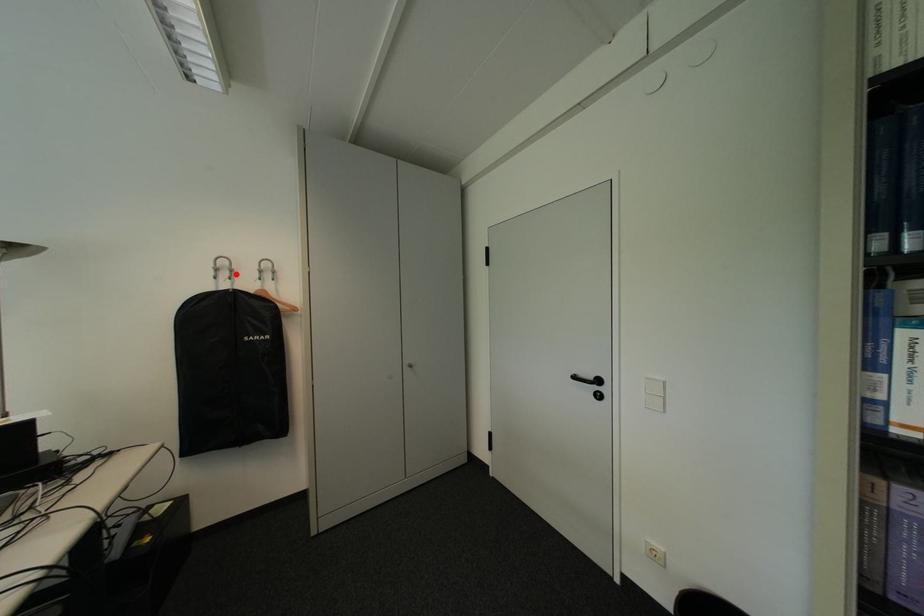
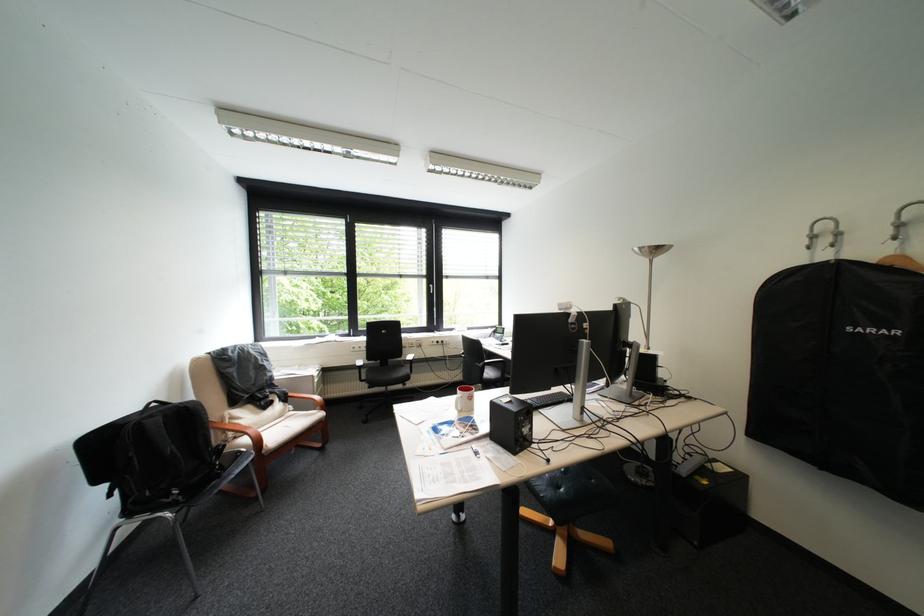
Locate, in the second image, the point that corresponds to the highlighted location in the first image.

(837, 241)